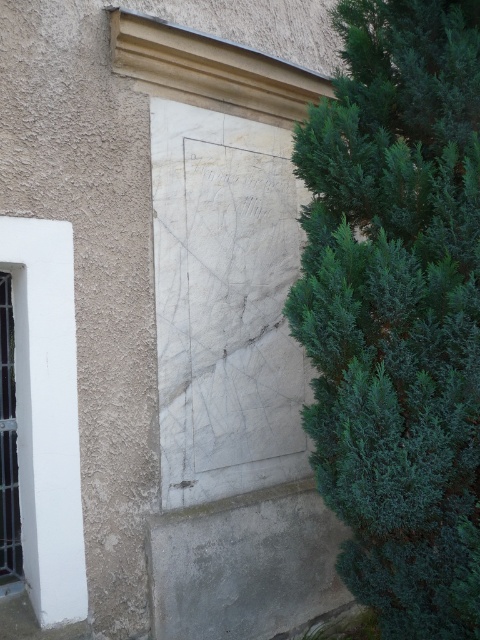
You are standing in front of the building described. You want to know if the green leafy bush at right can block the view of the white matte window at left from your current position. Can it?

The green leafy bush at right is much taller than the white matte window at left, so it is likely blocking the view of the white matte window at left from your current position.

You are a painter who needs to place a ladder between the green leafy bush at right and the clear glass window at left. The ladder is 1.5 meters wide. Can you fit the ladder between them without moving either object?

The distance between the green leafy bush at right and the clear glass window at left is 1.21 meters. Since the ladder is 1.5 meters wide, it cannot fit between them as the space is narrower than the ladder.